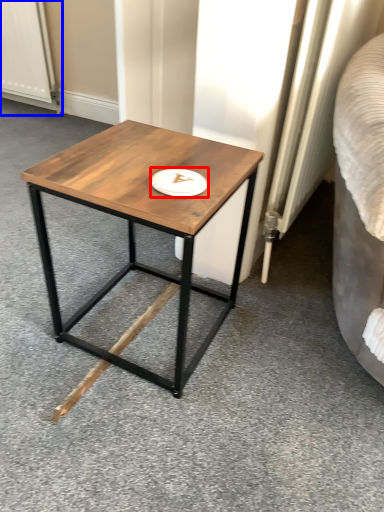
Question: Which object is closer to the camera taking this photo, platter (highlighted by a red box) or screen door (highlighted by a blue box)?

Choices:
 (A) platter
 (B) screen door

Answer: (A)